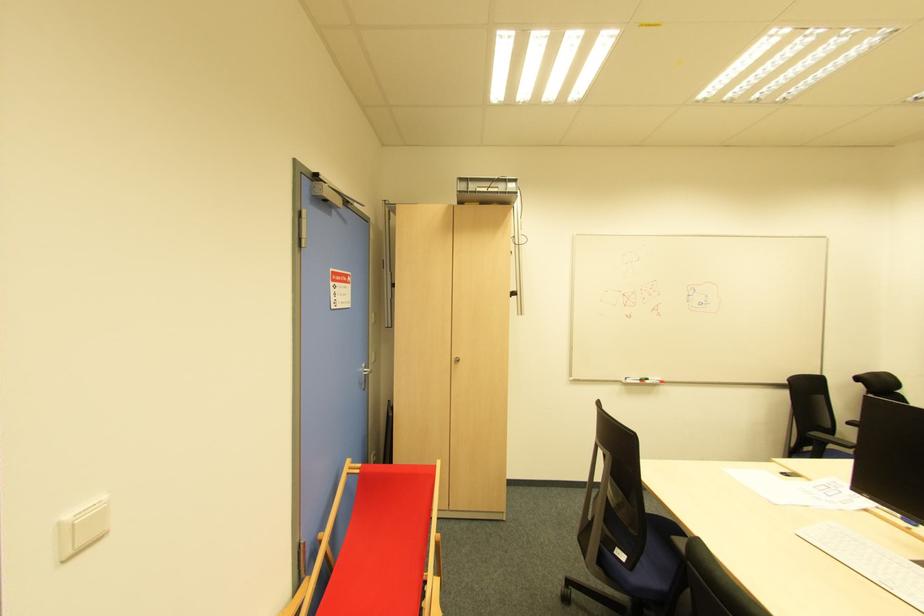
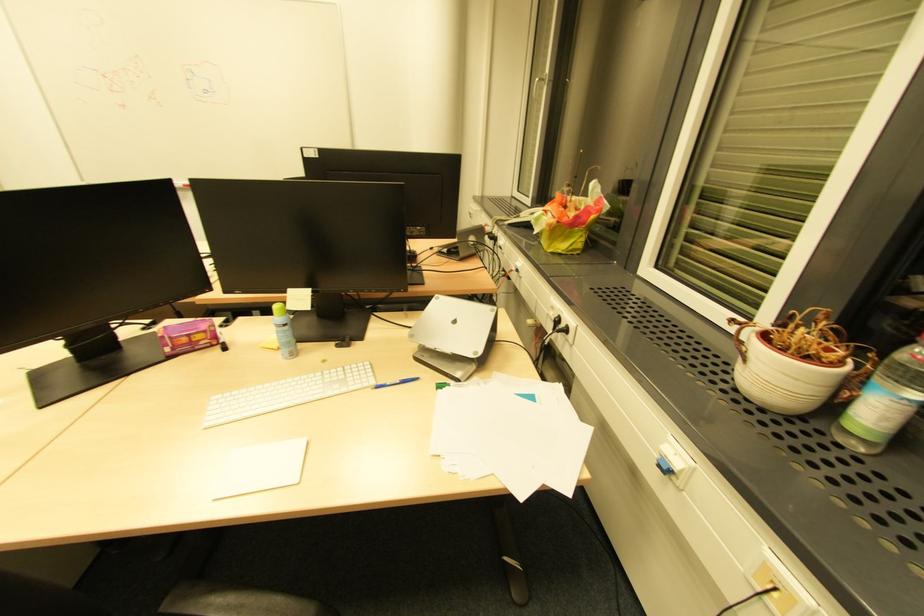
Question: Which direction would the cameraman need to move to produce the second image? Reply with the corresponding letter.

Choices:
 (A) Left
 (B) Right
 (C) Forward
 (D) Backward

Answer: (B)